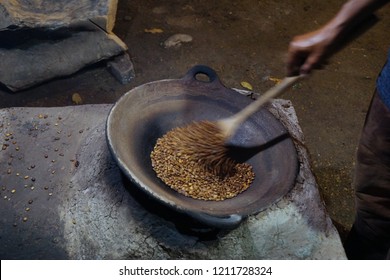
Where is `wooden spoon`? wooden spoon is located at coordinates (236, 121).